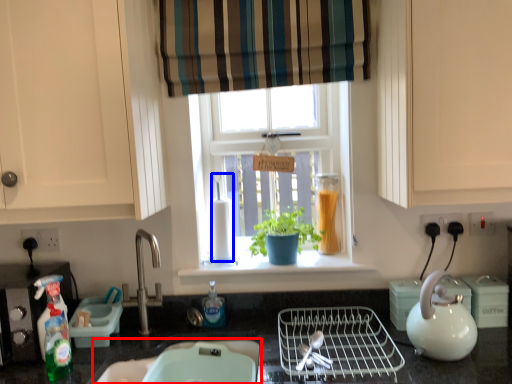
Question: Which of the following is the farthest to the observer, sink (highlighted by a red box) or blender (highlighted by a blue box)?

Choices:
 (A) sink
 (B) blender

Answer: (B)